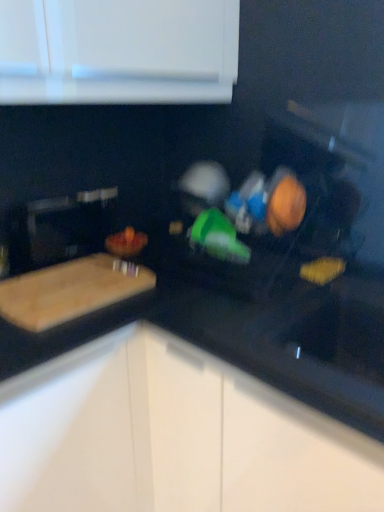
Image resolution: width=384 pixels, height=512 pixels. Identify the location of vacant area on top of natural wood cutting board at left (from a real-world perspective). (73, 276).